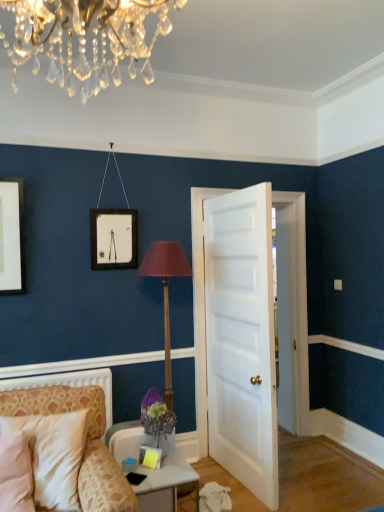
You are a GUI agent. You are given a task and a screenshot of the screen. Output one action in this format:
    pyautogui.click(x=<x>, y=<y>)
    Task: Click on the vacant space underneath white painted wood door at center (from a real-world perspective)
    Image resolution: width=384 pixels, height=512 pixels.
    Given the screenshot: What is the action you would take?
    pyautogui.click(x=234, y=479)